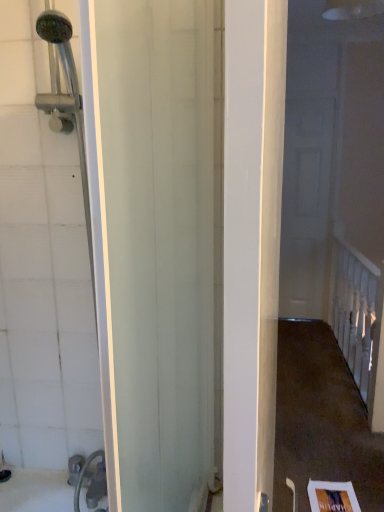
Question: Is there a large distance between white painted wood railing at upper right and white glossy door at right?

Choices:
 (A) no
 (B) yes

Answer: (A)

Question: From a real-world perspective, is white painted wood railing at upper right under white glossy door at right?

Choices:
 (A) yes
 (B) no

Answer: (A)

Question: Considering the relative sizes of white painted wood railing at upper right and white glossy door at right in the image provided, is white painted wood railing at upper right bigger than white glossy door at right?

Choices:
 (A) yes
 (B) no

Answer: (A)

Question: Considering the relative positions of white painted wood railing at upper right and white glossy door at right in the image provided, is white painted wood railing at upper right to the left of white glossy door at right from the viewer's perspective?

Choices:
 (A) yes
 (B) no

Answer: (B)

Question: Does white painted wood railing at upper right touch white glossy door at right?

Choices:
 (A) yes
 (B) no

Answer: (B)

Question: Can you confirm if white painted wood railing at upper right is wider than white glossy door at right?

Choices:
 (A) yes
 (B) no

Answer: (A)

Question: Can you confirm if white glossy door at right is shorter than white painted wood railing at upper right?

Choices:
 (A) no
 (B) yes

Answer: (A)

Question: From a real-world perspective, is white glossy door at right physically below white painted wood railing at upper right?

Choices:
 (A) yes
 (B) no

Answer: (B)

Question: Is white glossy door at right in contact with white painted wood railing at upper right?

Choices:
 (A) yes
 (B) no

Answer: (B)

Question: Is white glossy door at right positioned with its back to white painted wood railing at upper right?

Choices:
 (A) yes
 (B) no

Answer: (B)

Question: Is the position of white glossy door at right less distant than that of white painted wood railing at upper right?

Choices:
 (A) no
 (B) yes

Answer: (A)

Question: Is white glossy door at right not close to white painted wood railing at upper right?

Choices:
 (A) no
 (B) yes

Answer: (A)

Question: Is white painted wood railing at upper right taller or shorter than white glossy door at right?

Choices:
 (A) tall
 (B) short

Answer: (B)